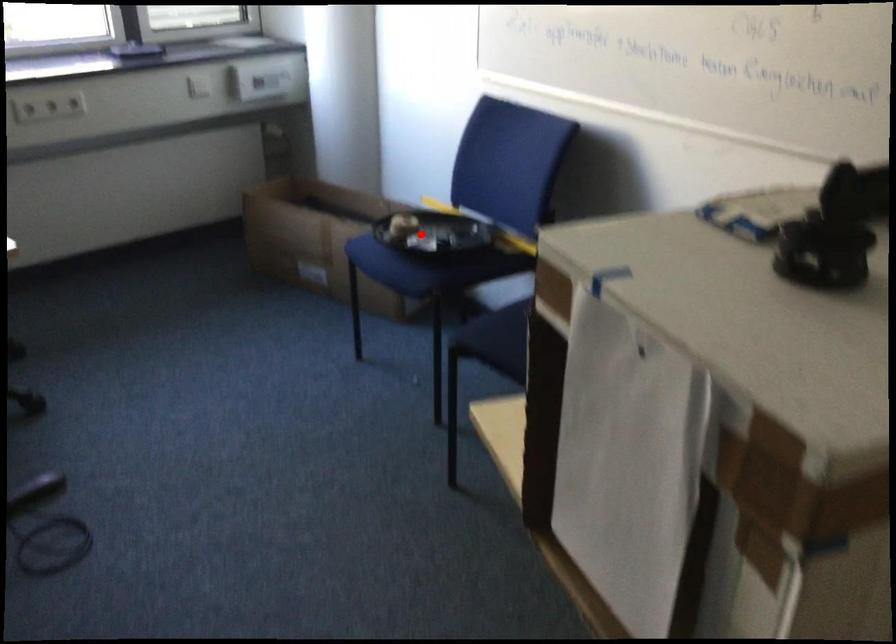
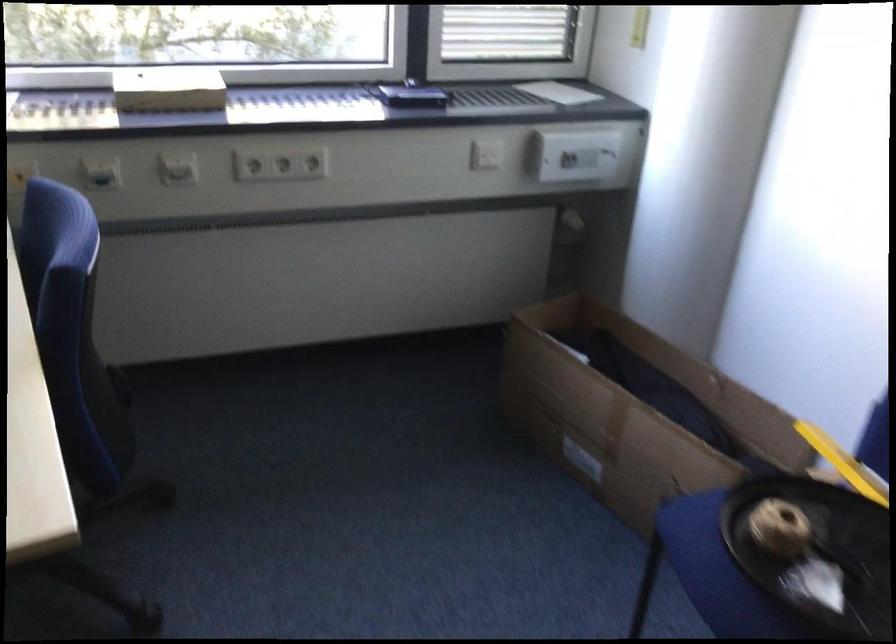
In the second image, find the point that corresponds to the highlighted location in the first image.

(813, 552)